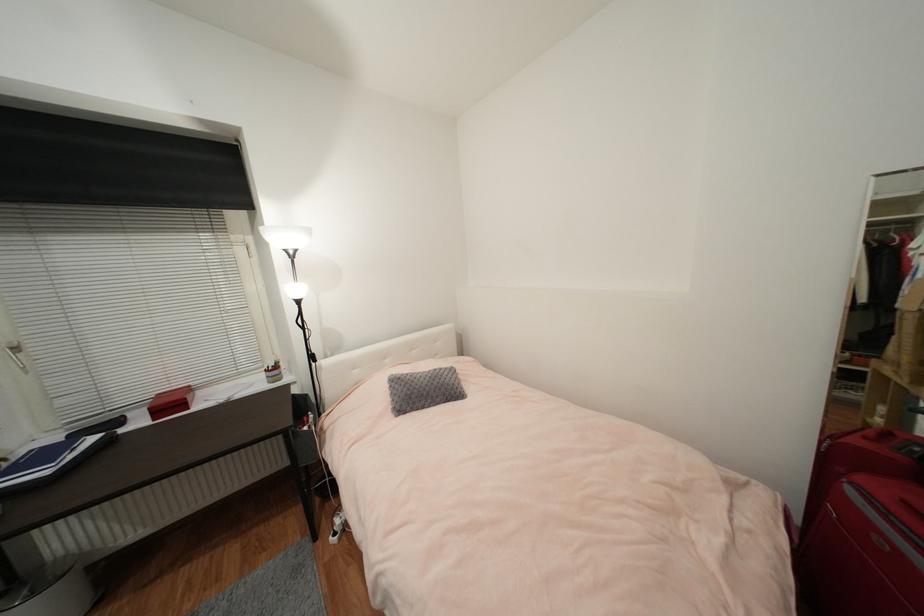
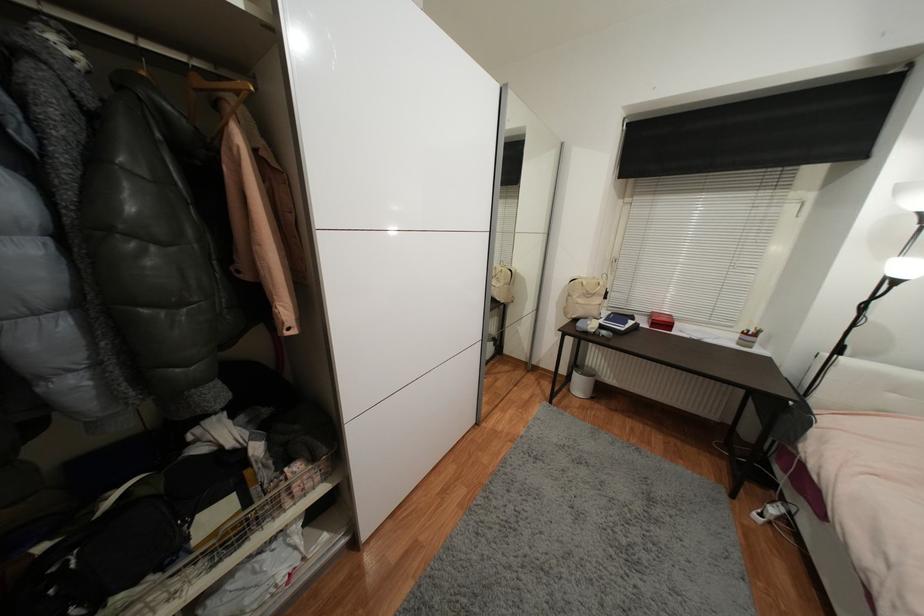
From the picture: How did the camera likely rotate?

The camera's rotation is toward left-down.